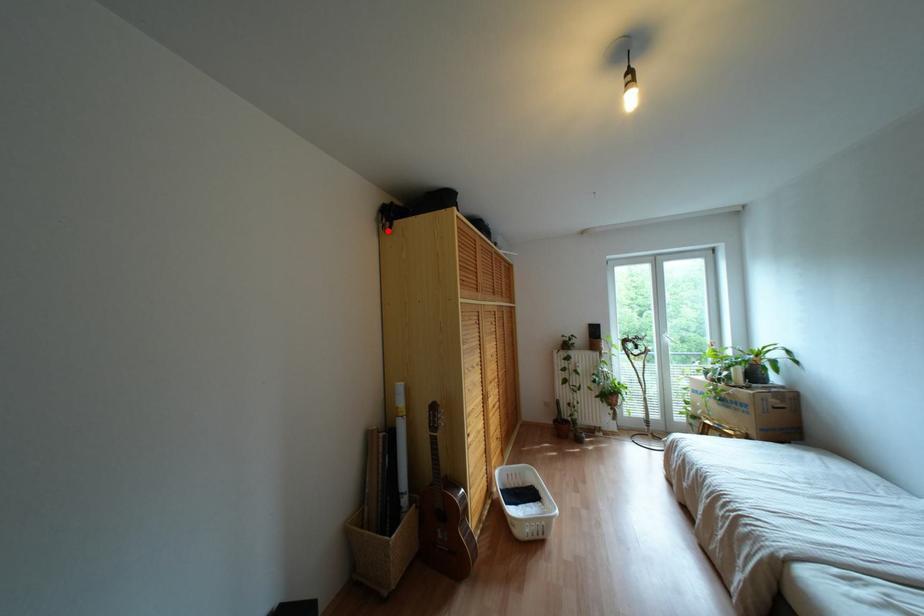
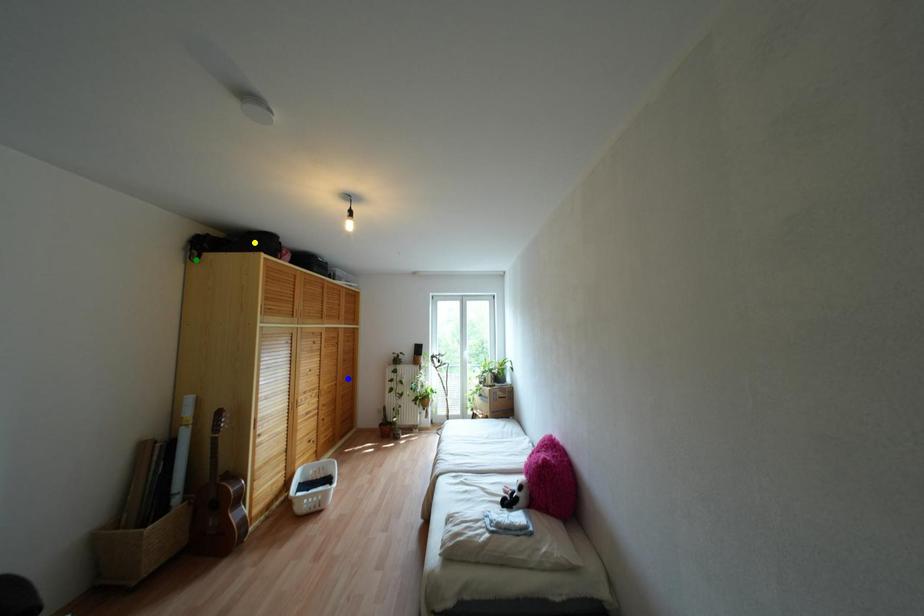
Question: I am providing you with two images of the same scene from different viewpoints. A red point is marked on the first image. You are given multiple points on the second image. Which point in image 2 represents the same 3d spot as the red point in image 1?

Choices:
 (A) yellow point
 (B) green point
 (C) blue point

Answer: (B)